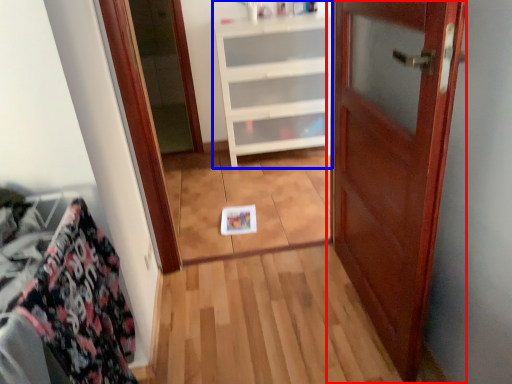
Question: Which point is closer to the camera, door (highlighted by a red box) or cabinetry (highlighted by a blue box)?

Choices:
 (A) door
 (B) cabinetry

Answer: (A)